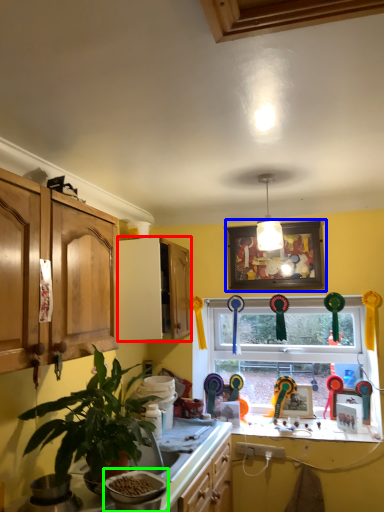
Question: Which object is positioned farthest from cabinetry (highlighted by a red box)? Select from picture frame (highlighted by a blue box) and appliance (highlighted by a green box).

Choices:
 (A) picture frame
 (B) appliance

Answer: (B)